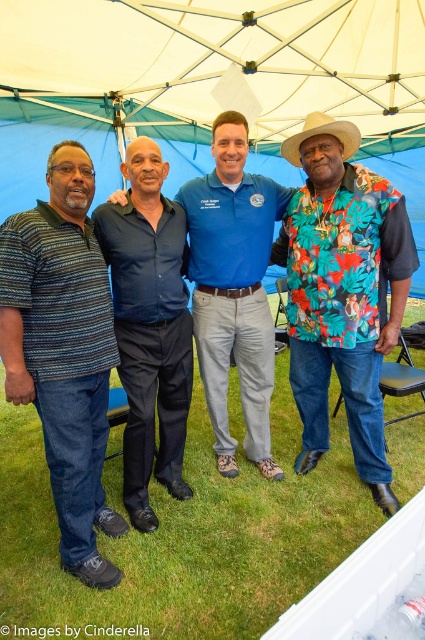
You are standing under the large white canopy tent with a blue interior at the event. There is a blue fabric canopy at upper center marked by point [209,84]. If you want to hang a decoration exactly at that point, which direction should you move from your current position under the tent to reach it?

To reach the blue fabric canopy at upper center marked by point [209,84], you should move towards the upper center direction from your current position under the tent.

You are a photographer standing at the edge of the event area. You want to take a photo that includes both the blue fabric canopy at upper center and the floral print shirt at right. Given that your camera has a maximum focus range of 5 feet, will you be able to capture both subjects clearly in the same frame?

The distance between the blue fabric canopy at upper center and the floral print shirt at right is 5.82 feet, which exceeds the camera maximum focus range of 5 feet. Therefore, you cannot capture both subjects clearly in the same frame.

You are standing at the point labeled point (x=20, y=296) and want to walk to the point labeled point (x=363, y=292). Is there a clear path between these two points without any obstacles?

The path between point (x=363, y=292) and point (x=20, y=296) is clear because point (x=363, y=292) is behind point 0.049, so there are no obstacles blocking the way.